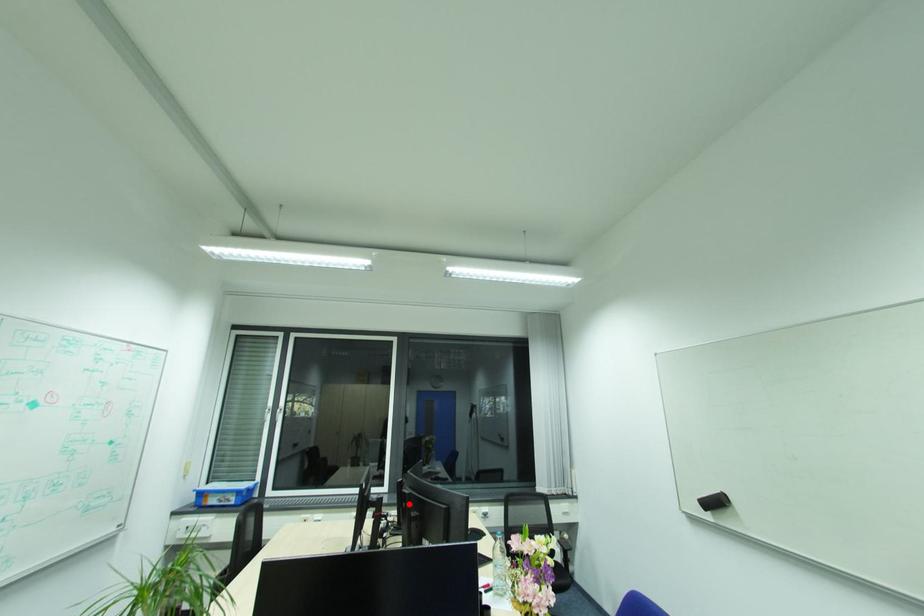
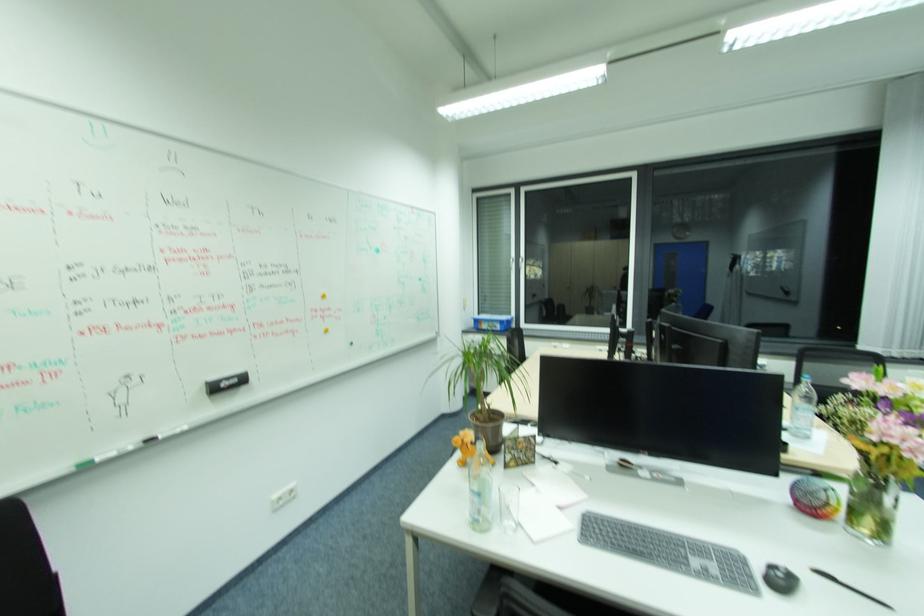
Where in the second image is the point corresponding to the highlighted location from the first image?

(666, 334)